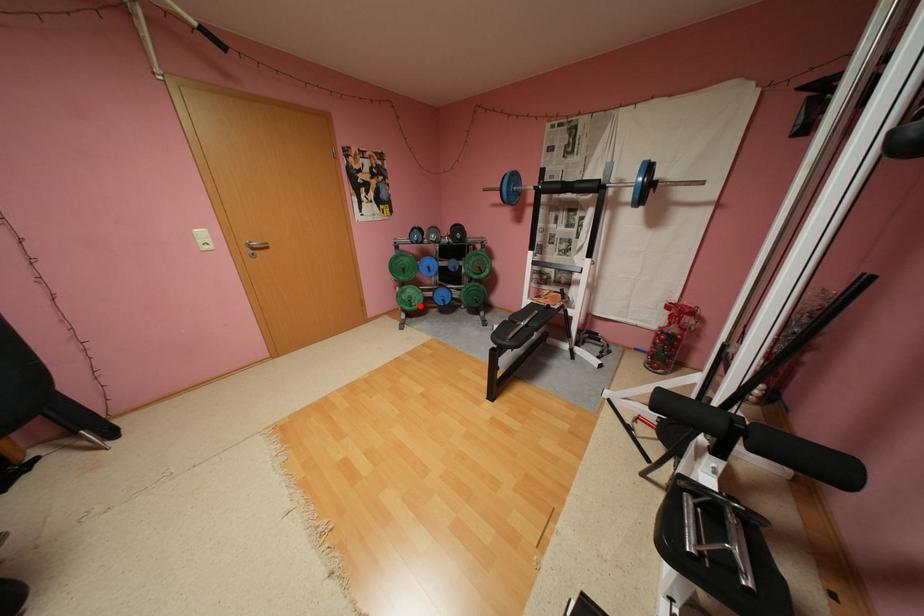
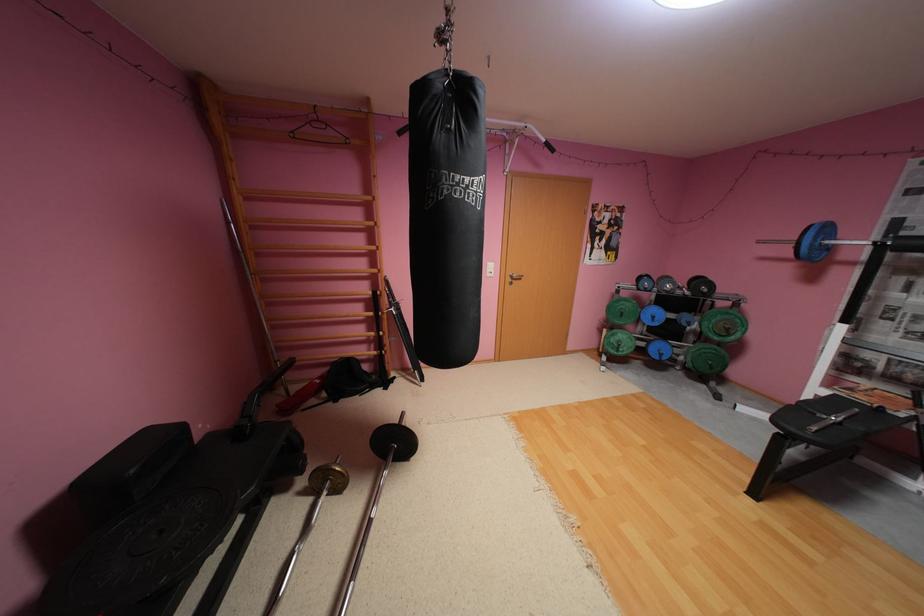
The point at the highlighted location is marked in the first image. Where is the corresponding point in the second image?

(626, 351)